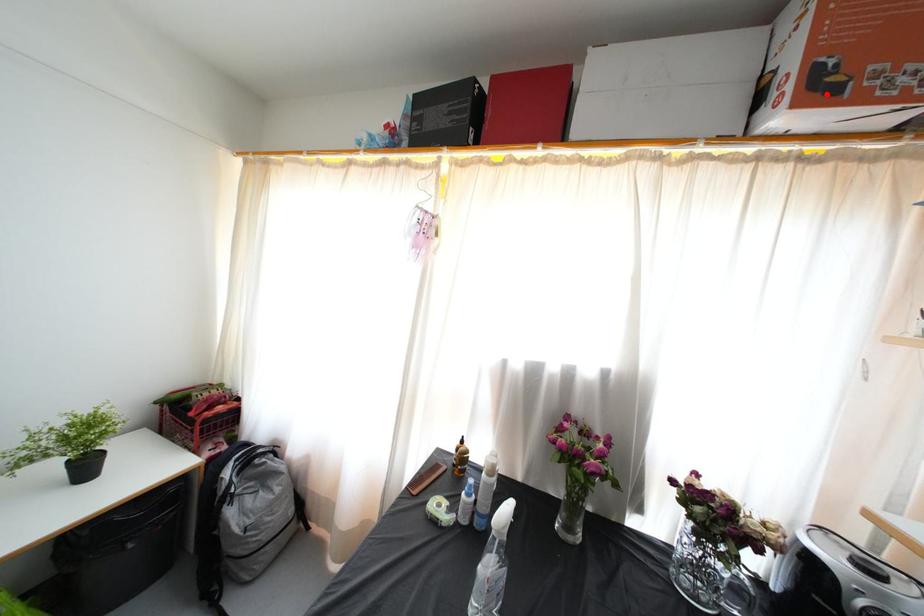
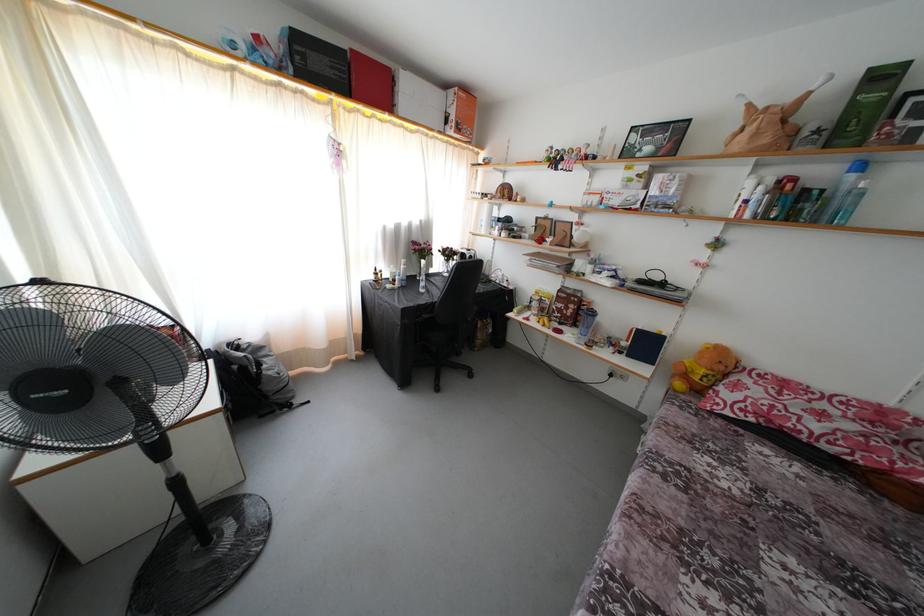
Question: I am providing you with two images of the same scene from different viewpoints. Given a red point in image1, look at the same physical point in image2. Is it:

Choices:
 (A) Closer to the viewpoint
 (B) Farther from the viewpoint

Answer: (A)